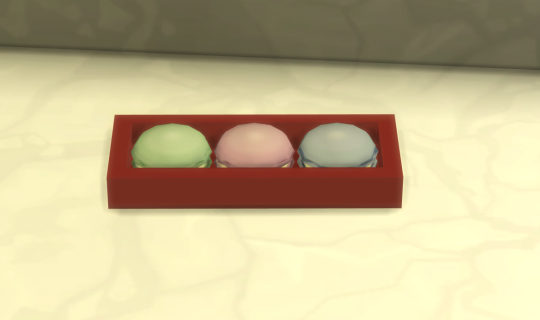
Find the location of a particular element. This screenshot has width=540, height=320. wall is located at coordinates (369, 15).